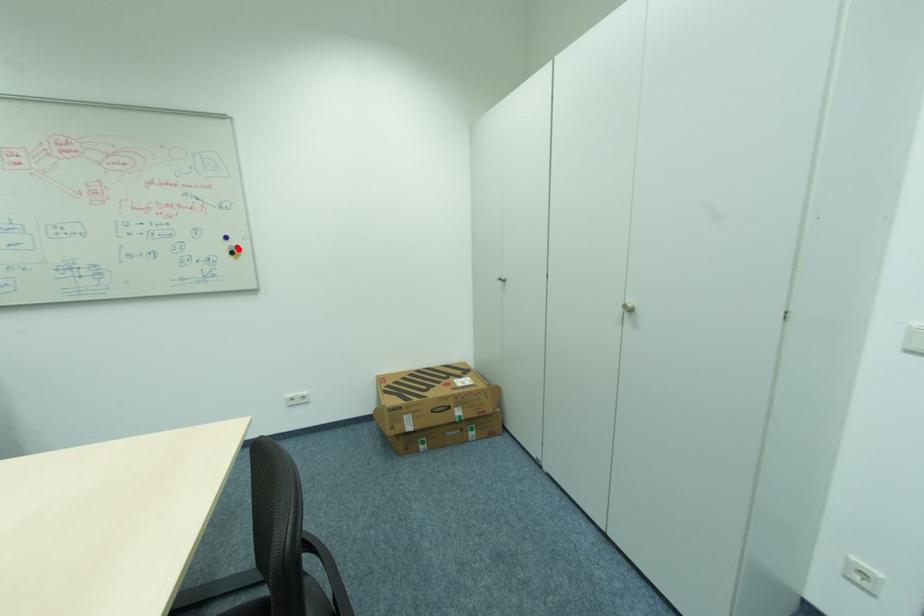
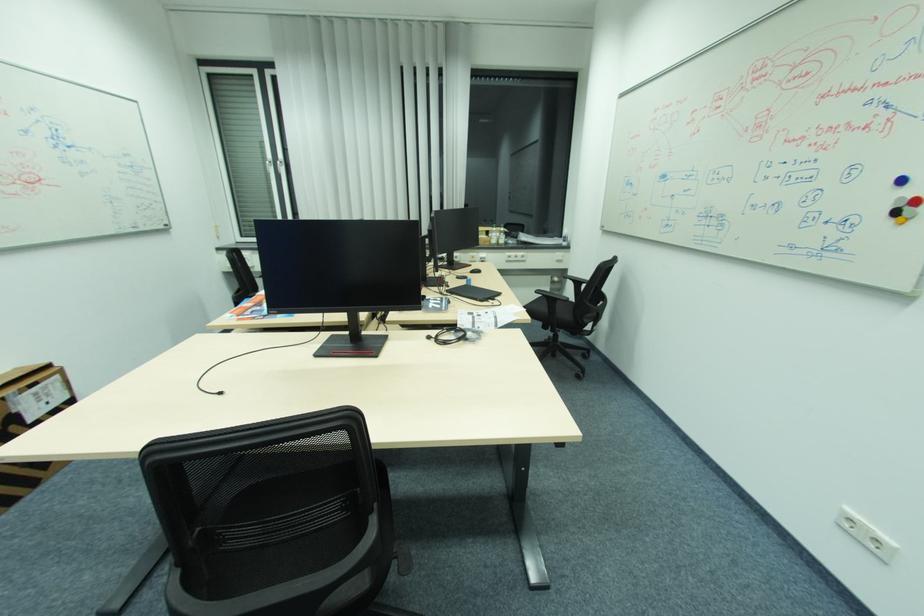
In the second image, find the point that corresponds to the highlighted location in the first image.

(907, 206)